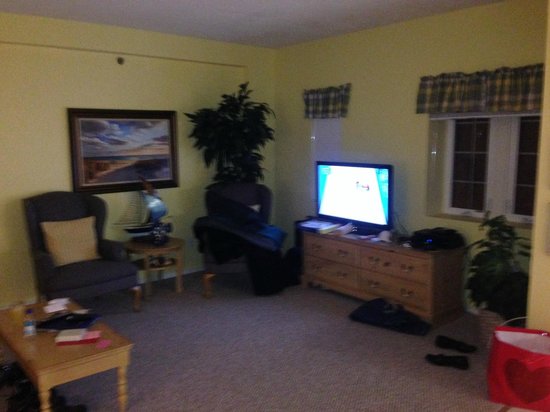
Find the location of a particular element. This screenshot has height=412, width=550. plant is located at coordinates (510, 292).